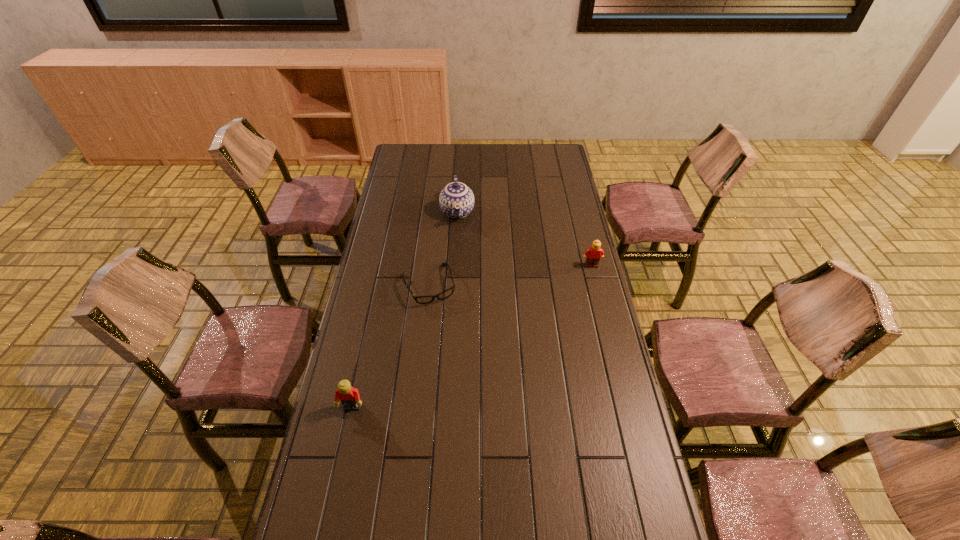
Identify the location of free spot on the desktop that is between the left Lego and the right Lego and is positioned on the front-facing side of the shortest object. The image size is (960, 540). (453, 348).

Locate an element on the screen. The height and width of the screenshot is (540, 960). free space on the desktop that is between the nearest object and the right Lego and is positioned at the spout of the tallest object is located at coordinates (464, 341).